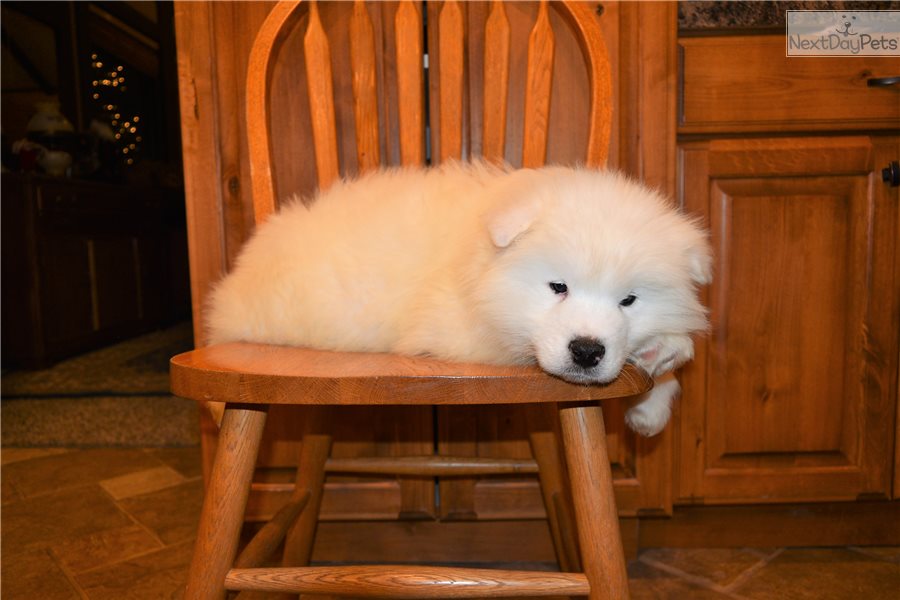
The image size is (900, 600). Identify the location of lamp. (54, 161).